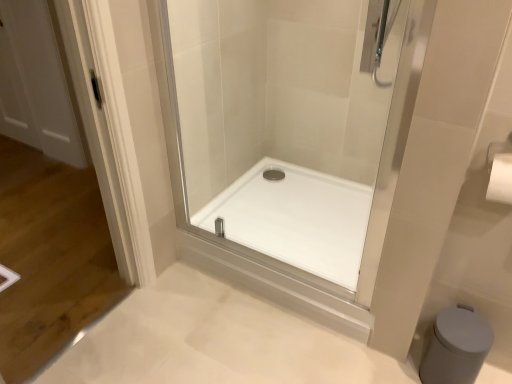
At what (x,y) coordinates should I click in order to perform the action: click on vacant space in transparent glass shower door at center (from a real-world perspective). Please return your answer as a coordinate pair (x, y). Looking at the image, I should click on (269, 262).